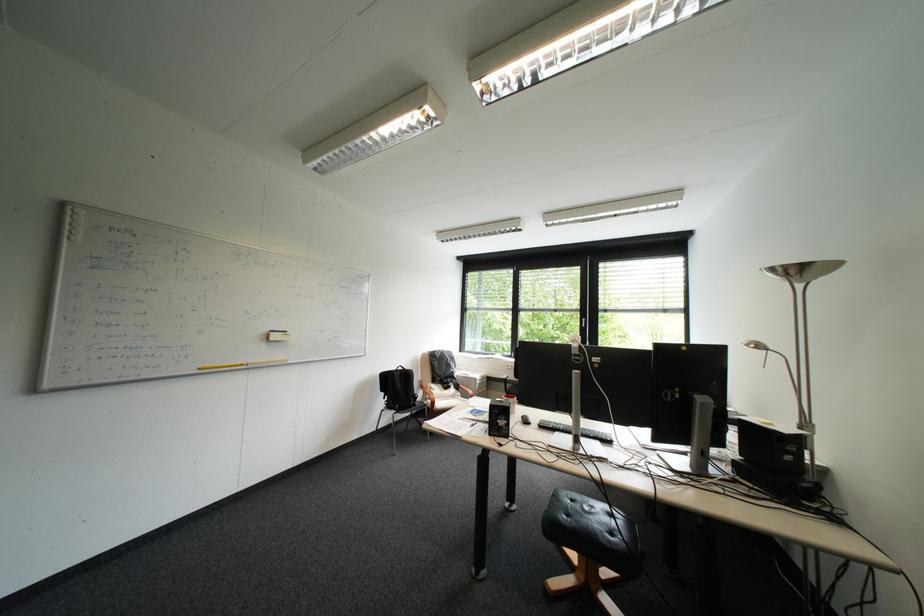
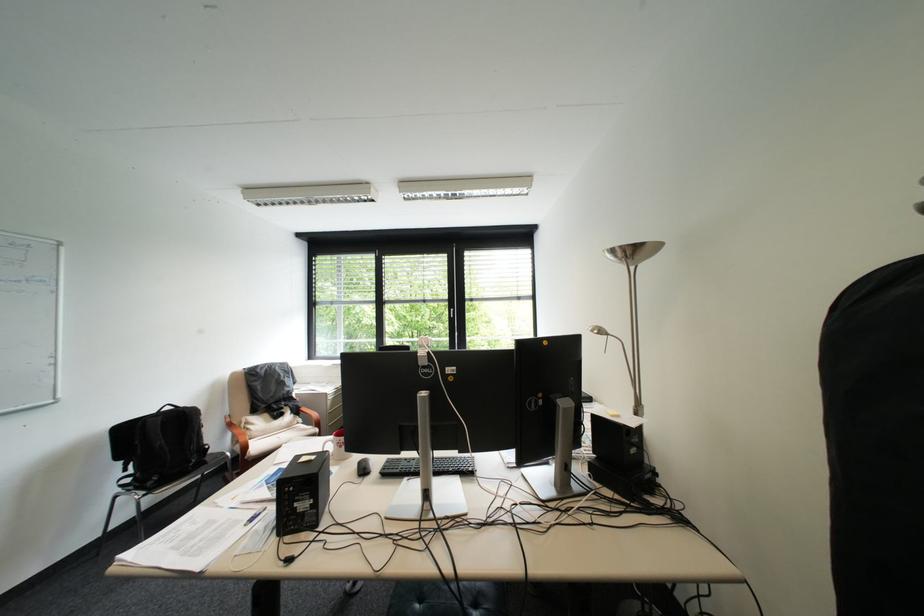
Question: The camera is either moving clockwise (left) or counter-clockwise (right) around the object. The first image is from the beginning of the video and the second image is from the end. Is the camera moving left or right when shooting the video?

Choices:
 (A) Left
 (B) Right

Answer: (A)